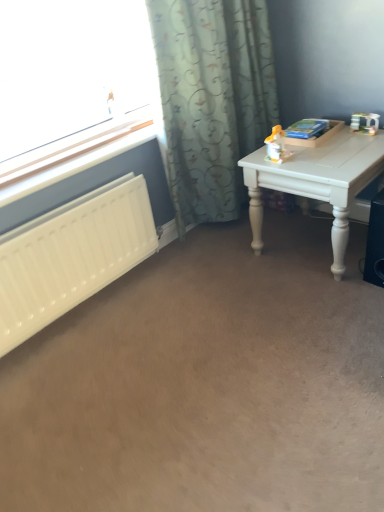
Find the location of `vacant space situated on the left part of white painted wood table at right`. vacant space situated on the left part of white painted wood table at right is located at coordinates (228, 273).